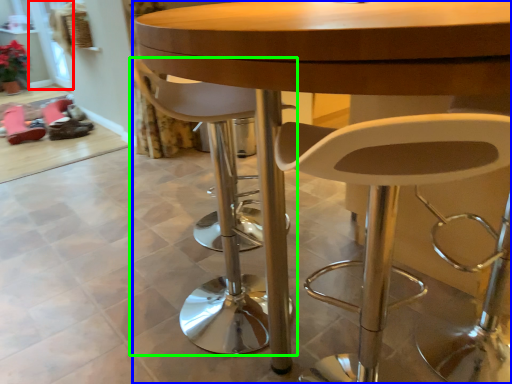
Question: Which object is positioned farthest from glass door (highlighted by a red box)? Select from table (highlighted by a blue box) and chair (highlighted by a green box).

Choices:
 (A) table
 (B) chair

Answer: (A)